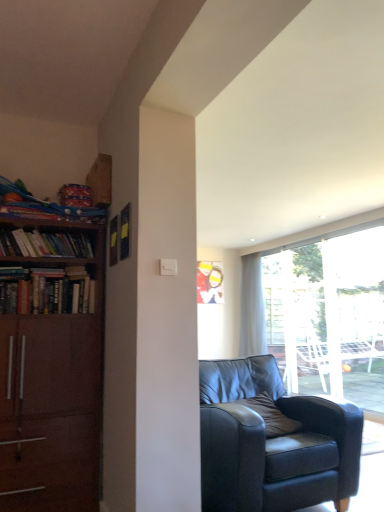
Question: From a real-world perspective, is matte black armchair at center above or below brown leather pillow at center?

Choices:
 (A) below
 (B) above

Answer: (A)

Question: From the image's perspective, is matte black armchair at center located above or below brown leather pillow at center?

Choices:
 (A) above
 (B) below

Answer: (B)

Question: Estimate the real-world distances between objects in this image. Which object is farther from the wooden bookshelf at left, which is the 1th book in bottom-to-top order?

Choices:
 (A) hardcover books at left, which ranks as the first book in top-to-bottom order
 (B) matte black armchair at center
 (C) brown leather pillow at center
 (D) white sheer curtain at center

Answer: (D)

Question: Estimate the real-world distances between objects in this image. Which object is closer to the matte black armchair at center?

Choices:
 (A) wooden bookshelf at left, positioned as the 2th book in top-to-bottom order
 (B) brown leather pillow at center
 (C) white sheer curtain at center
 (D) hardcover books at left, which ranks as the first book in top-to-bottom order

Answer: (B)